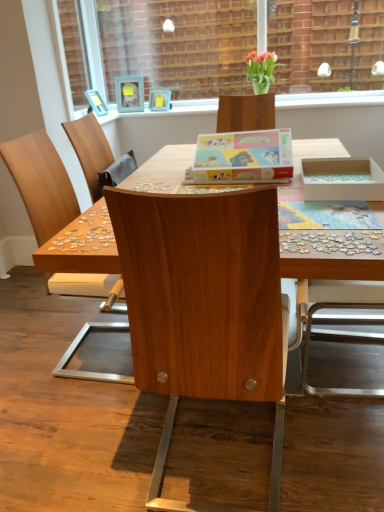
Find the location of `free space in front of wooden chair at center`. free space in front of wooden chair at center is located at coordinates (83, 422).